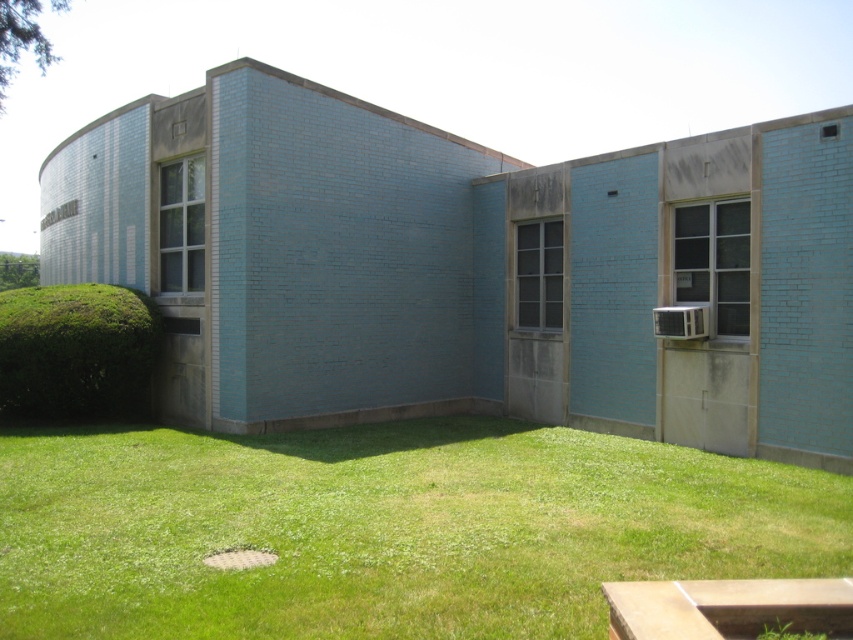
Can you confirm if green grass at lower center is wider than green leafy hedge at lower left?

Yes, green grass at lower center is wider than green leafy hedge at lower left.

Does green grass at lower center lie in front of green leafy hedge at lower left?

Yes, it is in front of green leafy hedge at lower left.

Which is in front, point (728, 566) or point (28, 301)?

Positioned in front is point (728, 566).

This screenshot has height=640, width=853. I want to click on green grass at lower center, so click(384, 529).